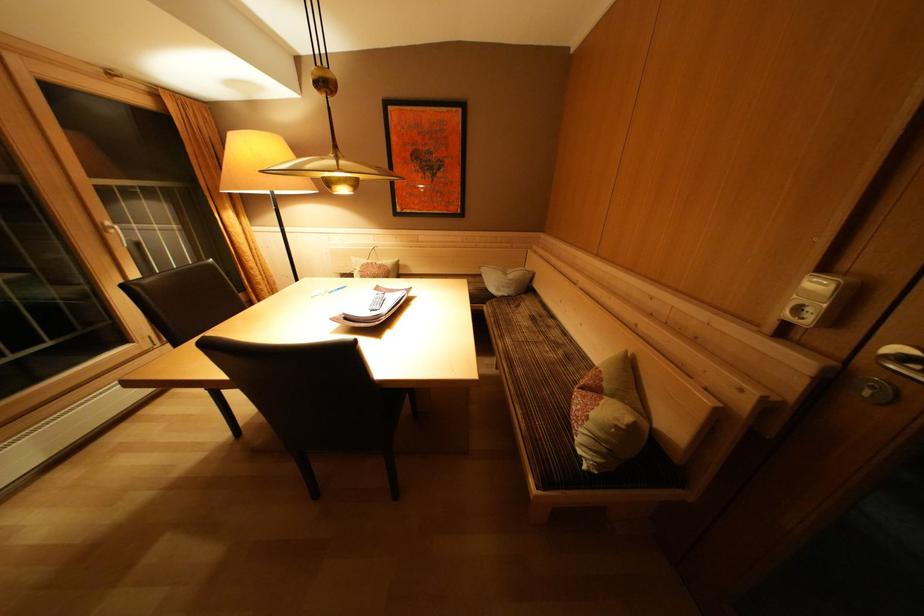
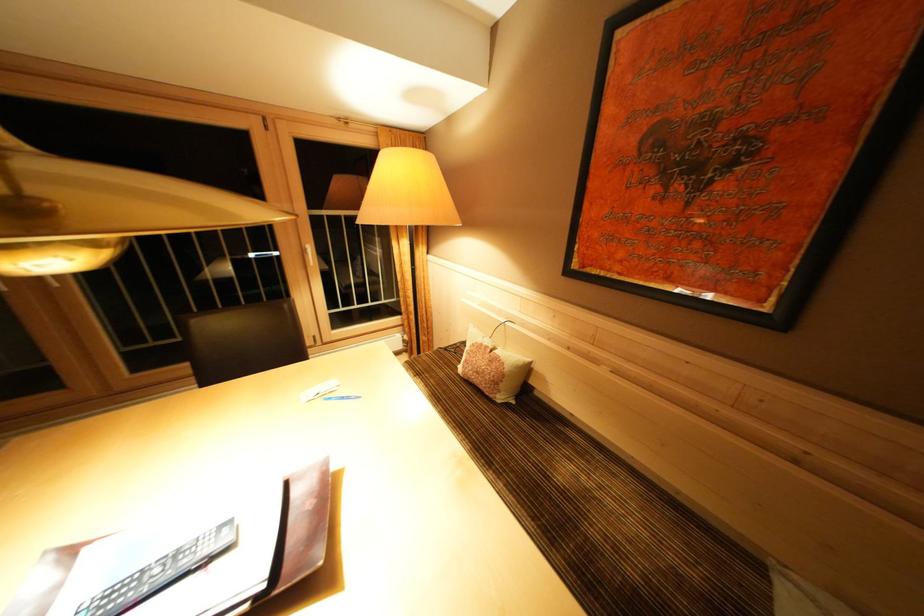
Find the pixel in the second image that matches point (107, 236) in the first image.

(310, 256)